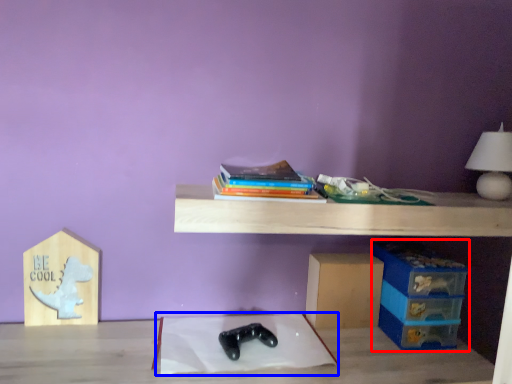
Question: Which point is further to the camera, storage box (highlighted by a red box) or sheet (highlighted by a blue box)?

Choices:
 (A) storage box
 (B) sheet

Answer: (A)